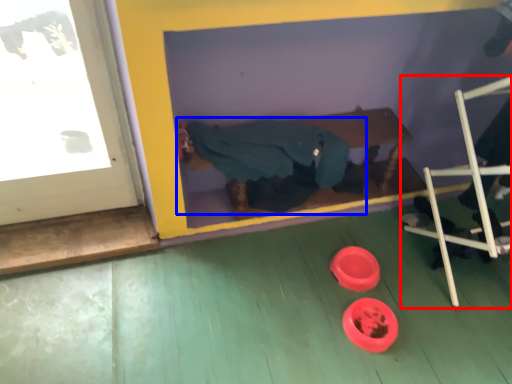
Question: Which object is closer to the camera taking this photo, furniture (highlighted by a red box) or person (highlighted by a blue box)?

Choices:
 (A) furniture
 (B) person

Answer: (A)